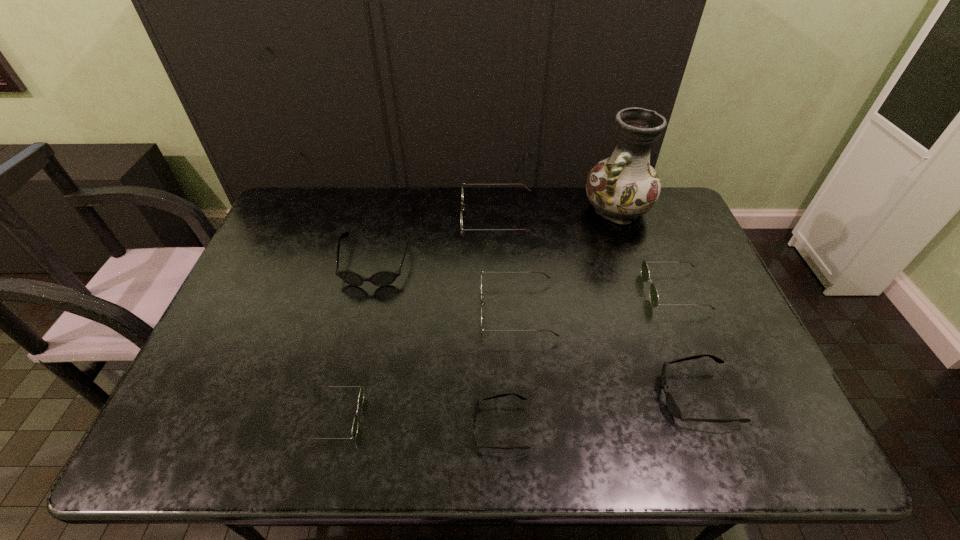
Find the location of a particular element. The width and height of the screenshot is (960, 540). vacant space located 0.270m on the front-facing side of the second smallest green sunglasses is located at coordinates (552, 291).

Identify the location of blank space located 0.270m on the front-facing side of the second smallest green sunglasses. (552, 291).

The height and width of the screenshot is (540, 960). I want to click on vacant space located 0.090m on the front-facing side of the second smallest green sunglasses, so click(614, 291).

Locate an element on the screen. The width and height of the screenshot is (960, 540). vacant space located on the lenses of the second biggest black sunglasses is located at coordinates (601, 397).

I want to click on free spot located 0.360m on the lenses of the second biggest black sunglasses, so click(x=507, y=397).

What are the coordinates of `vacant space located 0.120m on the lenses of the second biggest black sunglasses` in the screenshot? It's located at (610, 397).

Where is `free space located 0.210m on the front-facing side of the smallest green sunglasses`? The image size is (960, 540). free space located 0.210m on the front-facing side of the smallest green sunglasses is located at coordinates (453, 417).

This screenshot has width=960, height=540. What are the coordinates of `free space located on the lenses of the smallest black sunglasses` in the screenshot? It's located at (427, 427).

Where is `free location located on the lenses of the smallest black sunglasses`? The image size is (960, 540). free location located on the lenses of the smallest black sunglasses is located at coordinates (409, 427).

Where is `vacant space located 0.310m on the lenses of the smallest black sunglasses`? vacant space located 0.310m on the lenses of the smallest black sunglasses is located at coordinates (332, 427).